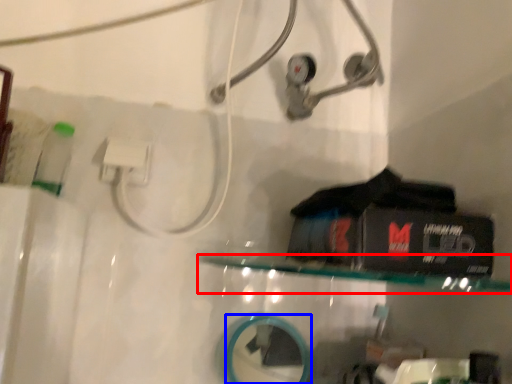
Question: Which object is further to the camera taking this photo, shelf (highlighted by a red box) or mirror (highlighted by a blue box)?

Choices:
 (A) shelf
 (B) mirror

Answer: (B)